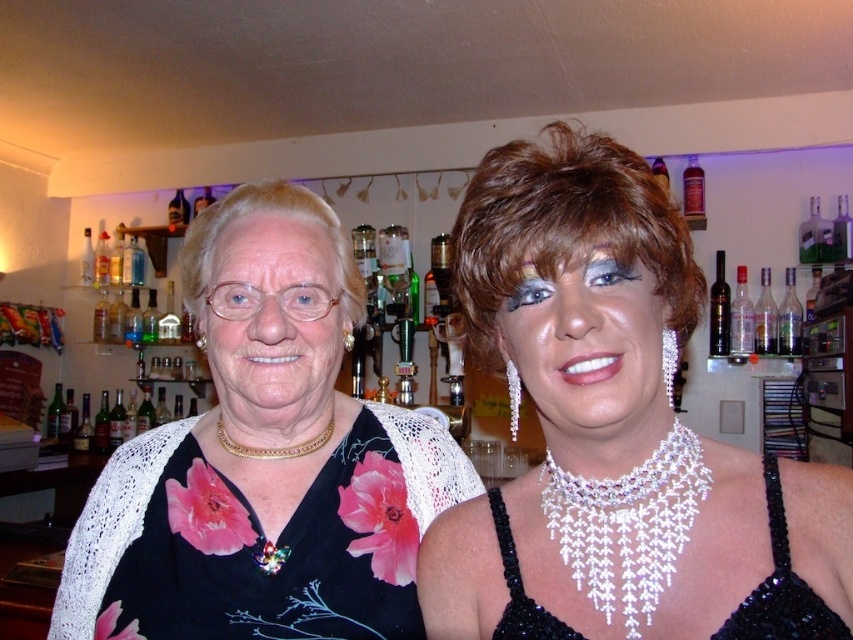
Can you confirm if white beaded necklace at center is taller than gold metallic necklace at center?

Correct, white beaded necklace at center is much taller as gold metallic necklace at center.

Between point (633, 518) and point (309, 440), which one is positioned behind?

Point (309, 440)

Is point (636, 512) positioned after point (300, 451)?

No, it is not.

Where is `white beaded necklace at center`? The height and width of the screenshot is (640, 853). white beaded necklace at center is located at coordinates (627, 525).

Who is higher up, gold metallic earring at center or pearl earrings at left?

Positioned higher is gold metallic earring at center.

Does gold metallic earring at center come in front of pearl earrings at left?

Yes, gold metallic earring at center is in front of pearl earrings at left.

Which is in front, point (344, 337) or point (201, 346)?

Positioned in front is point (344, 337).

I want to click on gold metallic earring at center, so click(x=347, y=339).

Does point (526, 196) come closer to viewer compared to point (723, 337)?

Yes, it is in front of point (723, 337).

Can you confirm if sparkly silver necklace at center is smaller than dark glass bottle at center?

Incorrect, sparkly silver necklace at center is not smaller in size than dark glass bottle at center.

Is point (711, 627) behind point (722, 276)?

No, it is not.

I want to click on sparkly silver necklace at center, so click(x=614, y=433).